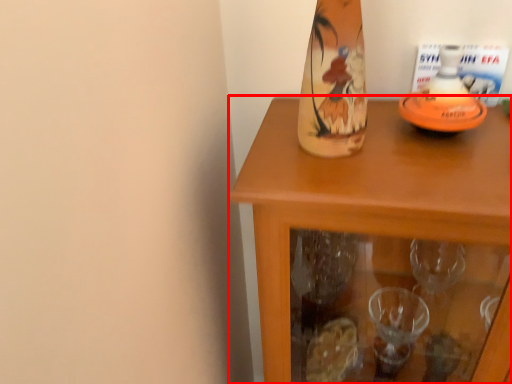
Question: In this image, where is table (annotated by the red box) located relative to bottle?

Choices:
 (A) right
 (B) left

Answer: (A)